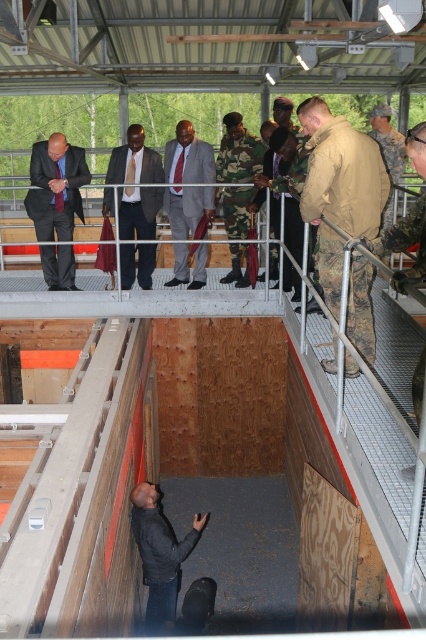
Question: Which point appears farthest from the camera in this image?

Choices:
 (A) (143, 547)
 (B) (115, 157)

Answer: (B)

Question: Does matte black suit at center appear over matte gray suit at center?

Choices:
 (A) yes
 (B) no

Answer: (B)

Question: Is camouflage uniform at center smaller than matte black suit at left?

Choices:
 (A) no
 (B) yes

Answer: (B)

Question: Does camouflage uniform at center have a smaller size compared to matte black suit at center?

Choices:
 (A) no
 (B) yes

Answer: (B)

Question: Which of the following is the closest to the observer?

Choices:
 (A) camouflage uniform at center
 (B) matte black suit at left
 (C) black matte jacket at lower center
 (D) matte black suit at center

Answer: (A)

Question: Based on their relative distances, which object is farther from the camouflage uniform at center?

Choices:
 (A) black matte jacket at lower center
 (B) matte black suit at center
 (C) matte gray suit at center

Answer: (B)